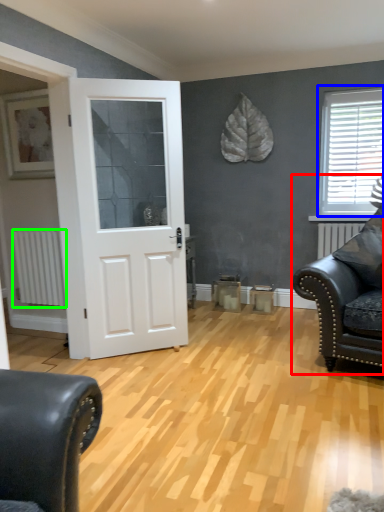
Question: Which object is the farthest from studio couch (highlighted by a red box)? Choose among these: window (highlighted by a blue box) or radiator (highlighted by a green box).

Choices:
 (A) window
 (B) radiator

Answer: (B)